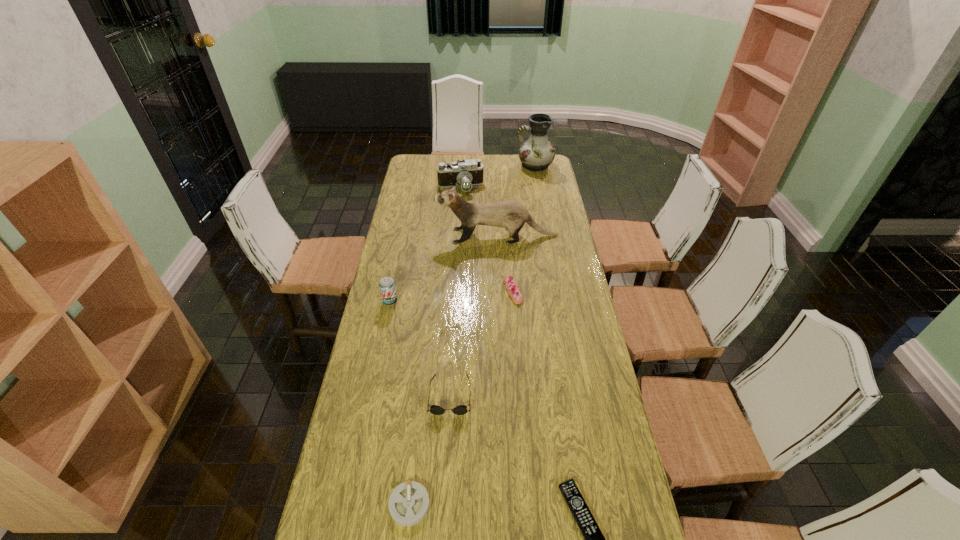
You are a GUI agent. You are given a task and a screenshot of the screen. Output one action in this format:
    pyautogui.click(x=<x>, y=<y>)
    Task: Click on the vacant space that's between the seventh nearest object and the sixth tallest object
    
    Given the screenshot: What is the action you would take?
    pyautogui.click(x=487, y=240)

This screenshot has width=960, height=540. What are the coordinates of `vacant point located between the beer can and the third shortest object` in the screenshot? It's located at (451, 296).

Where is `vacant space that is in between the third shortest object and the second farthest object`? vacant space that is in between the third shortest object and the second farthest object is located at coordinates (487, 240).

What are the coordinates of `unoccupied position between the second shortest object and the second farthest object` in the screenshot? It's located at (435, 346).

Identify the location of empty space between the second shortest object and the vase. (472, 335).

This screenshot has width=960, height=540. Identify the location of free space between the seventh nearest object and the vase. click(497, 177).

You are a GUI agent. You are given a task and a screenshot of the screen. Output one action in this format:
    pyautogui.click(x=<x>, y=<y>)
    Task: Click on the object that is the fifth closest to the ashtray
    The image size is (960, 540).
    Given the screenshot: What is the action you would take?
    (x=510, y=214)

Image resolution: width=960 pixels, height=540 pixels. Find the location of `object that is the seventh nearest to the ashtray`. object that is the seventh nearest to the ashtray is located at coordinates (537, 153).

Identify the location of vacant area that satisfies the following two spatial constraints: 1. at the lens of the eclair; 2. on the left side of the camera. This screenshot has height=540, width=960. coord(454,291).